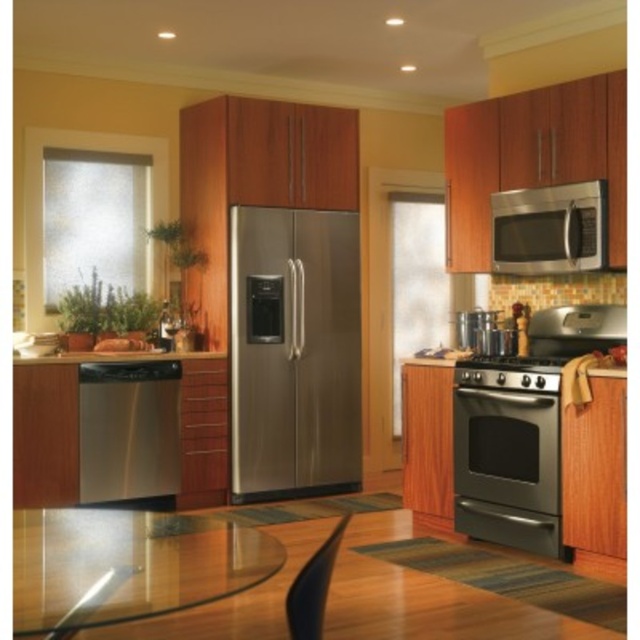
You are a kitchen designer planning to install a new appliance. You have a space that can accommodate a 24 inch wide appliance. You see the stainless steel dishwasher at lower left and the stainless steel microwave at upper right. Which of these two appliances can fit into the 24 inch space?

The stainless steel microwave at upper right can fit into the 24 inch space because the stainless steel dishwasher at lower left is wider than it.

You are a delivery person who just arrived at the kitchen to place a new countertop that requires a height of 1 meter. You see the transparent glass table at lower center and the stainless steel microwave at upper right. Which object is shorter and would be suitable for placing the countertop?

The transparent glass table at lower center is shorter than the stainless steel microwave at upper right, so it would be suitable for placing the countertop that requires a height of 1 meter.